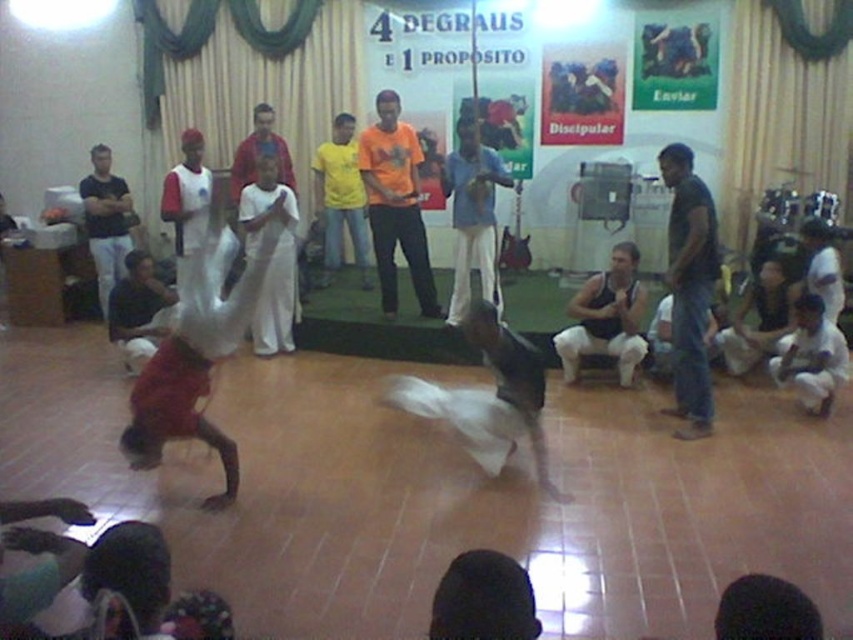
Is black tank top at center above dark gray pants at left?

Incorrect, black tank top at center is not positioned above dark gray pants at left.

Which of these two, black tank top at center or dark gray pants at left, stands taller?

Standing taller between the two is dark gray pants at left.

Does point (596, 326) come closer to viewer compared to point (90, 236)?

Yes.

Find the location of `black tank top at center`. black tank top at center is located at coordinates (606, 317).

Does orange t-shirt at center have a greater width compared to black tank top at center?

In fact, orange t-shirt at center might be narrower than black tank top at center.

Is point (402, 248) positioned after point (625, 307)?

Yes.

The width and height of the screenshot is (853, 640). What do you see at coordinates (395, 204) in the screenshot?
I see `orange t-shirt at center` at bounding box center [395, 204].

In order to click on orange t-shirt at center in this screenshot , I will do `click(395, 204)`.

Between dark blue jeans at right and black tank top at center, which one appears on the right side from the viewer's perspective?

dark blue jeans at right

What do you see at coordinates (689, 288) in the screenshot? Image resolution: width=853 pixels, height=640 pixels. I see `dark blue jeans at right` at bounding box center [689, 288].

The height and width of the screenshot is (640, 853). What do you see at coordinates (689, 288) in the screenshot?
I see `dark blue jeans at right` at bounding box center [689, 288].

This screenshot has height=640, width=853. I want to click on dark blue jeans at right, so click(x=689, y=288).